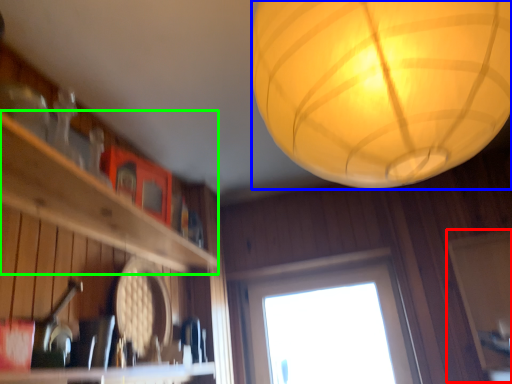
Question: Based on their relative distances, which object is nearer to screen door (highlighted by a red box)? Choose from lantern (highlighted by a blue box) and shelf (highlighted by a green box).

Choices:
 (A) lantern
 (B) shelf

Answer: (A)